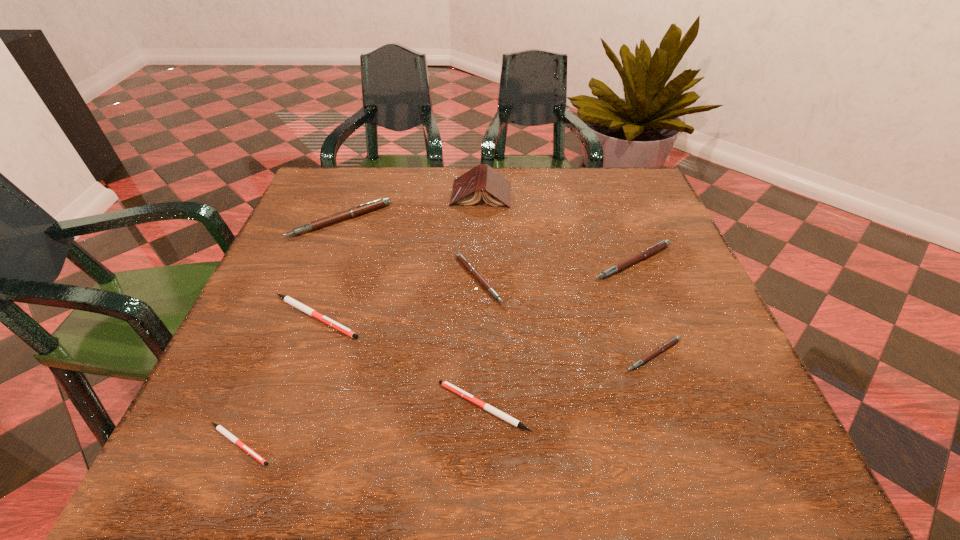
At what (x,y) coordinates should I click in order to perform the action: click on brown book. Please return your answer as a coordinate pair (x, y). Looking at the image, I should click on (467, 189).

Locate an element on the screen. The image size is (960, 540). the tallest object is located at coordinates (467, 189).

The image size is (960, 540). I want to click on the second tallest object, so click(361, 209).

Identify the location of the farthest pink pen. (361, 209).

The height and width of the screenshot is (540, 960). Identify the location of the sixth shortest object. (653, 249).

The height and width of the screenshot is (540, 960). Find the location of `the second tallest pen`. the second tallest pen is located at coordinates (653, 249).

This screenshot has height=540, width=960. Identify the location of the second smallest pink pen. (460, 257).

Find the location of a particular element. the biggest white pen is located at coordinates 287,299.

Locate an element on the screen. The image size is (960, 540). the nearest pink pen is located at coordinates (672, 341).

The image size is (960, 540). I want to click on the rightmost white pen, so click(487, 407).